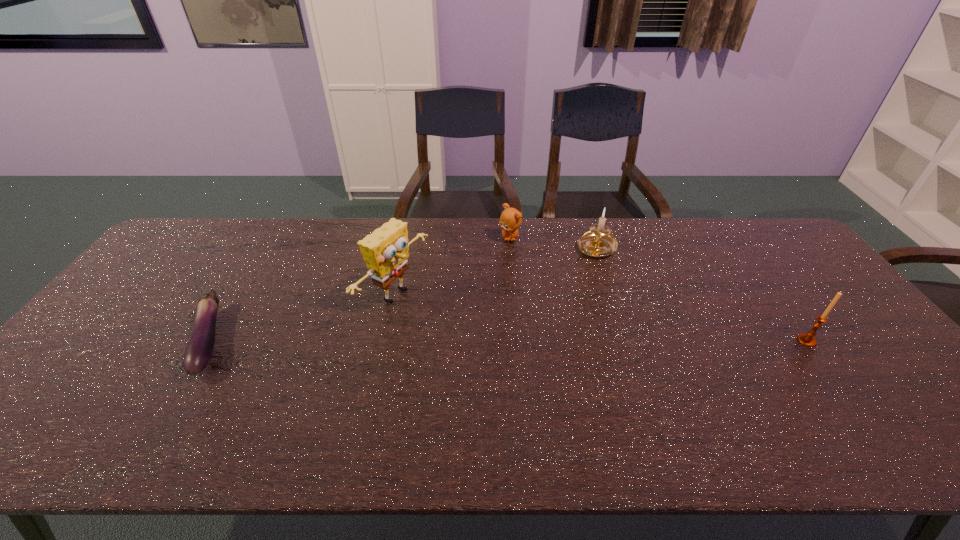
I want to click on free spot on the desktop that is between the shortest object and the rightmost object and is positioned on the face of the second shortest object, so click(513, 340).

Find the location of `vacant spot on the desktop that is between the shortest object and the rightmost object and is positioned on the face of the sponge`. vacant spot on the desktop that is between the shortest object and the rightmost object and is positioned on the face of the sponge is located at coordinates (488, 340).

The width and height of the screenshot is (960, 540). In order to click on free space on the desktop that is between the eggplant and the nearer candle holder and is positioned on the handle side of the fourth object from left to right in this screenshot , I will do `click(512, 340)`.